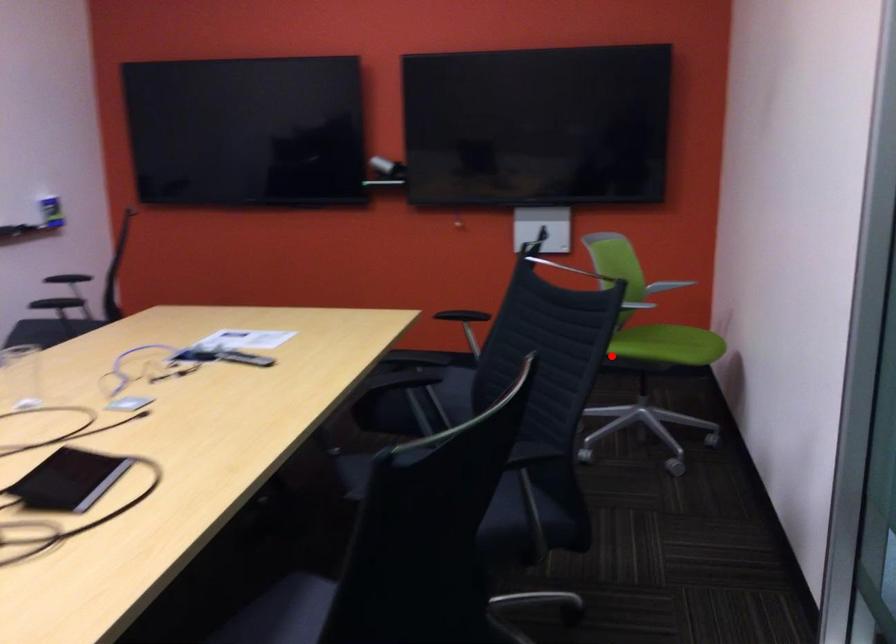
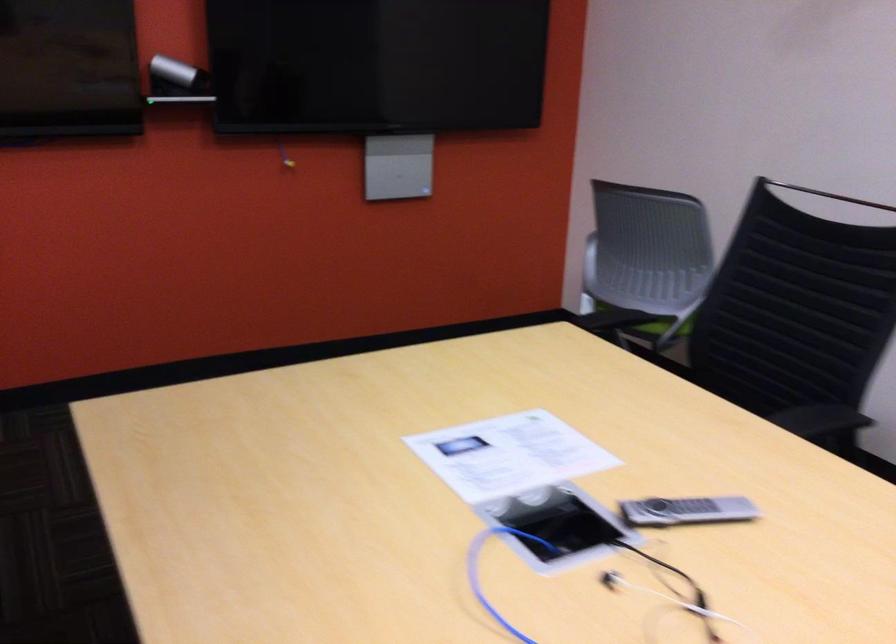
Question: I am providing you with two images of the same scene from different viewpoints. Image1 has a red point marked. In image2, the corresponding 3D location appears at what relative position? Reply with the corresponding letter.

Choices:
 (A) Closer
 (B) Farther

Answer: (A)